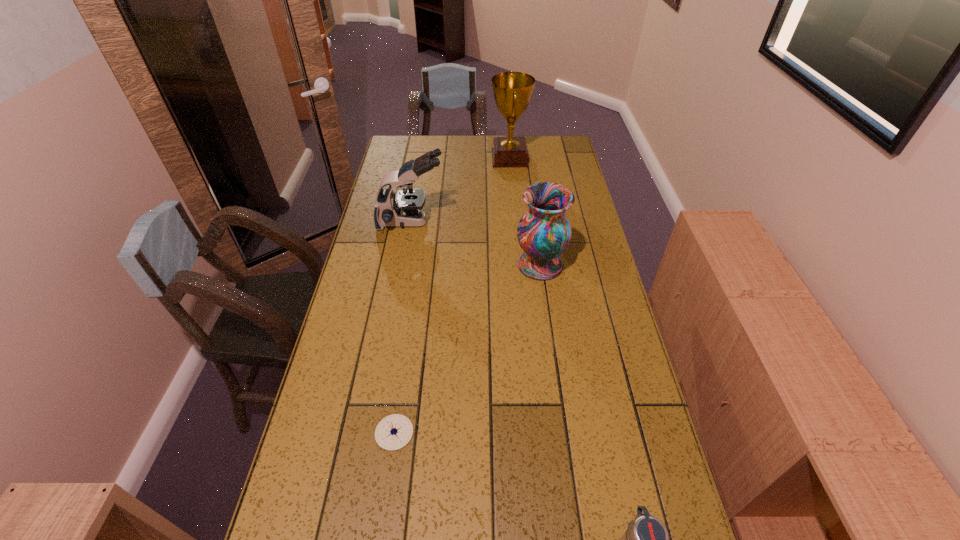
The width and height of the screenshot is (960, 540). I want to click on the tallest object, so click(512, 91).

You are a GUI agent. You are given a task and a screenshot of the screen. Output one action in this format:
    pyautogui.click(x=<x>, y=<y>)
    Task: Click on the award
    This screenshot has height=540, width=960.
    Given the screenshot: What is the action you would take?
    pyautogui.click(x=512, y=91)

The image size is (960, 540). I want to click on microscope, so click(404, 208).

Find the location of a particular element. the third farthest object is located at coordinates (544, 232).

Locate an element on the screen. This screenshot has height=540, width=960. the fourth farthest object is located at coordinates (393, 432).

What are the coordinates of `the shortest object` in the screenshot? It's located at tap(393, 432).

At what (x,y) coordinates should I click in order to perform the action: click on free space located 0.070m on the plaque of the farthest object. Please return your answer as a coordinate pair (x, y). This screenshot has width=960, height=540. Looking at the image, I should click on (474, 158).

Image resolution: width=960 pixels, height=540 pixels. Find the location of `vacant space situated 0.080m on the plaque of the farthest object`. vacant space situated 0.080m on the plaque of the farthest object is located at coordinates (472, 158).

You are a GUI agent. You are given a task and a screenshot of the screen. Output one action in this format:
    pyautogui.click(x=<x>, y=<y>)
    Task: Click on the vacant space located 0.140m on the plaque of the farthest object
    
    Given the screenshot: What is the action you would take?
    pyautogui.click(x=459, y=158)

This screenshot has height=540, width=960. I want to click on blank space located through the eyepieces of the microscope, so click(517, 222).